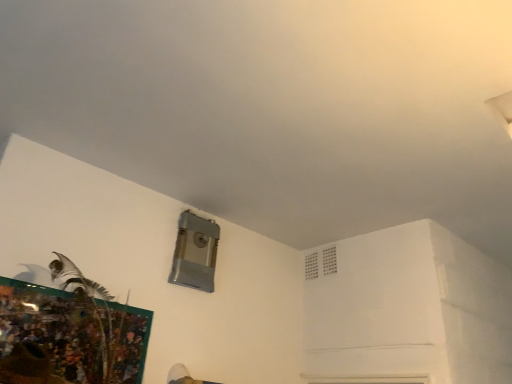
Question: Is metallic textured picture frame at lower left thinner than white plastic air conditioning at upper right?

Choices:
 (A) no
 (B) yes

Answer: (A)

Question: Is metallic textured picture frame at lower left aimed at white plastic air conditioning at upper right?

Choices:
 (A) no
 (B) yes

Answer: (A)

Question: Is metallic textured picture frame at lower left to the right of white plastic air conditioning at upper right from the viewer's perspective?

Choices:
 (A) no
 (B) yes

Answer: (A)

Question: From the image's perspective, is metallic textured picture frame at lower left below white plastic air conditioning at upper right?

Choices:
 (A) yes
 (B) no

Answer: (A)

Question: Can you see metallic textured picture frame at lower left touching white plastic air conditioning at upper right?

Choices:
 (A) no
 (B) yes

Answer: (A)

Question: Is metallic textured picture frame at lower left behind white plastic air conditioning at upper right?

Choices:
 (A) yes
 (B) no

Answer: (B)

Question: From a real-world perspective, does white plastic air conditioning at upper right stand above metallic textured picture frame at lower left?

Choices:
 (A) no
 (B) yes

Answer: (B)

Question: Can you confirm if white plastic air conditioning at upper right is positioned to the right of metallic textured picture frame at lower left?

Choices:
 (A) yes
 (B) no

Answer: (A)

Question: Could you tell me if white plastic air conditioning at upper right is facing metallic textured picture frame at lower left?

Choices:
 (A) no
 (B) yes

Answer: (A)

Question: Is white plastic air conditioning at upper right taller than metallic textured picture frame at lower left?

Choices:
 (A) no
 (B) yes

Answer: (A)

Question: Does white plastic air conditioning at upper right have a smaller size compared to metallic textured picture frame at lower left?

Choices:
 (A) no
 (B) yes

Answer: (B)

Question: Is metallic textured picture frame at lower left at the back of white plastic air conditioning at upper right?

Choices:
 (A) yes
 (B) no

Answer: (B)

Question: In the image, is white plastic air conditioning at upper right on the left side or the right side of metallic textured picture frame at lower left?

Choices:
 (A) left
 (B) right

Answer: (B)